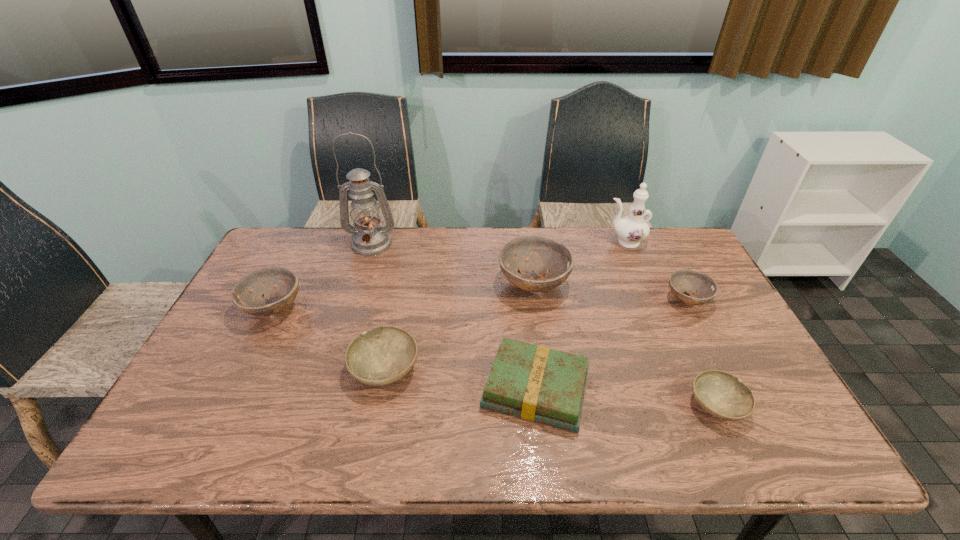
Where is `free spot located 0.210m on the left of the rightmost brown bowl`? The image size is (960, 540). free spot located 0.210m on the left of the rightmost brown bowl is located at coordinates (595, 300).

Identify the location of free location located 0.230m on the right of the book. The image size is (960, 540). (684, 389).

Locate an element on the screen. The image size is (960, 540). blank space located on the back of the right gray bowl is located at coordinates (666, 296).

Identify the location of oil lamp present at the far edge. (368, 239).

Where is `chinaware that is at the far edge`? Image resolution: width=960 pixels, height=540 pixels. chinaware that is at the far edge is located at coordinates (632, 229).

Find the location of a particular element. This screenshot has width=960, height=540. bowl situated at the far edge is located at coordinates (552, 261).

This screenshot has width=960, height=540. In order to click on book at the near edge in this screenshot , I will do `click(535, 383)`.

The height and width of the screenshot is (540, 960). In order to click on bowl situated at the near edge in this screenshot , I will do `click(721, 394)`.

Identify the location of object that is positioned at the left edge. The width and height of the screenshot is (960, 540). (246, 294).

Identify the location of chinaware located in the right edge section of the desktop. This screenshot has width=960, height=540. (632, 229).